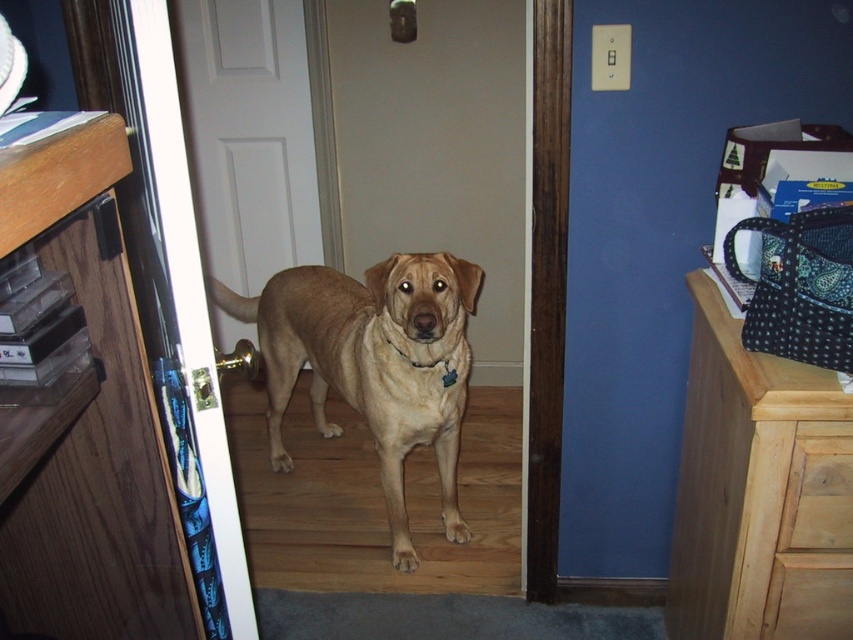
You are trying to decide whether to place a new rug in the room. The rug is designed to fit under the wooden dresser at left and the wooden dresser at right. Based on their positions, which dresser should the rug be placed closer to?

The wooden dresser at right should be closer to the rug because the wooden dresser at left is positioned above it, meaning the wooden dresser at right is lower and likely closer to the floor where the rug would lie.

You are a dog owner trying to choose a new collar for your dog. You see the golden tan fur at center and the black leather neckband at center in the image. Based on their sizes, which one would be more suitable as a collar for the dog?

The black leather neckband at center is more suitable as a collar because the golden tan fur at center is wider than the black leather neckband at center, indicating the fur is part of the dog and the neckband is the actual collar.